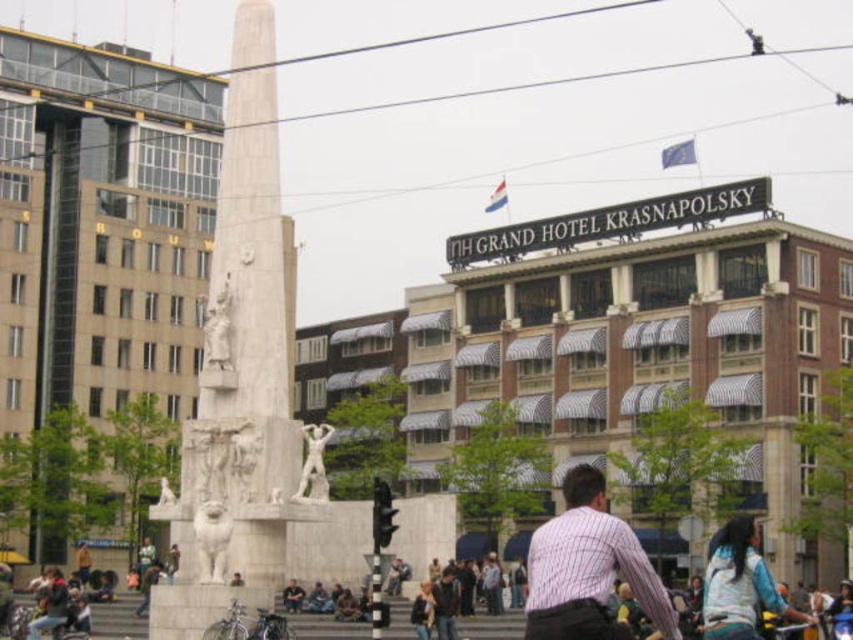
You are a tourist standing in front of the white marble monument at center and the white marble statue at center. Which one do you think is bigger?

The white marble monument at center is larger in size than the white marble statue at center.

You are a tourist standing in front of the white marble monument at center and the white marble statue at center. Which one is closer to you?

The white marble statue at center is closer to you because it is positioned under the white marble monument at center.